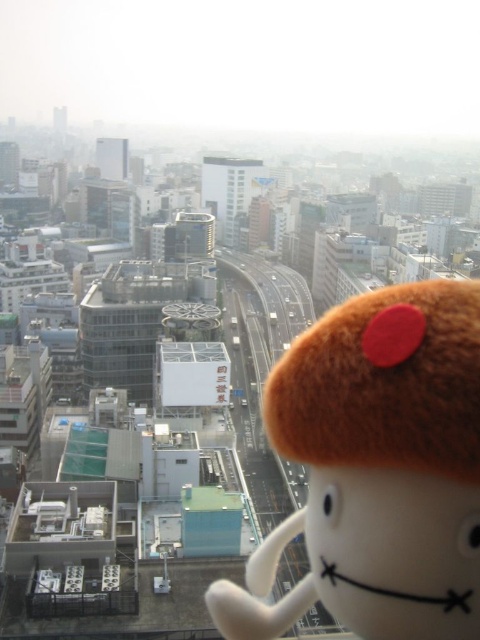
Question: Can you confirm if brown plush toy at lower right is wider than brown plush toy at center?

Choices:
 (A) no
 (B) yes

Answer: (A)

Question: Can you confirm if brown plush toy at lower right is thinner than brown plush toy at center?

Choices:
 (A) no
 (B) yes

Answer: (B)

Question: Which object appears closest to the camera in this image?

Choices:
 (A) brown plush toy at lower right
 (B) brown plush toy at center

Answer: (A)

Question: Is brown plush toy at lower right below brown plush toy at center?

Choices:
 (A) yes
 (B) no

Answer: (A)